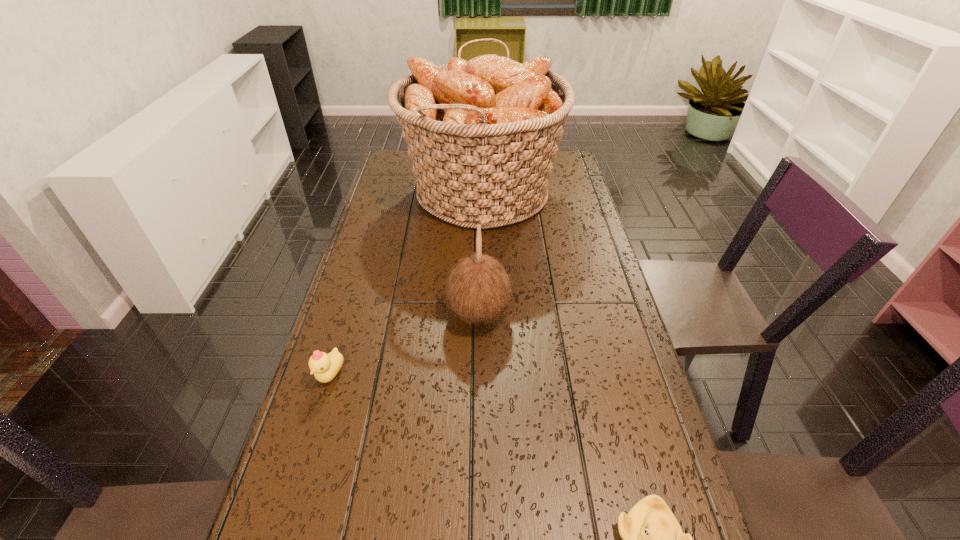
This screenshot has height=540, width=960. In order to click on vacant region between the second tallest object and the left duckling in this screenshot , I will do `click(405, 344)`.

The image size is (960, 540). I want to click on the closest object to the right duckling, so click(479, 289).

Identify the location of the second closest object to the leftmost object. (483, 134).

Locate an element on the screen. vacant space that satisfies the following two spatial constraints: 1. on the surface of the coconut; 2. on the front-facing side of the leftmost object is located at coordinates (479, 375).

Locate an element on the screen. The width and height of the screenshot is (960, 540). blank area in the image that satisfies the following two spatial constraints: 1. on the surface of the coconut; 2. on the front-facing side of the second nearest object is located at coordinates (479, 375).

Find the location of `vacant space that satisfies the following two spatial constraints: 1. on the surface of the coconut; 2. on the front-facing side of the second nearest object`. vacant space that satisfies the following two spatial constraints: 1. on the surface of the coconut; 2. on the front-facing side of the second nearest object is located at coordinates point(479,375).